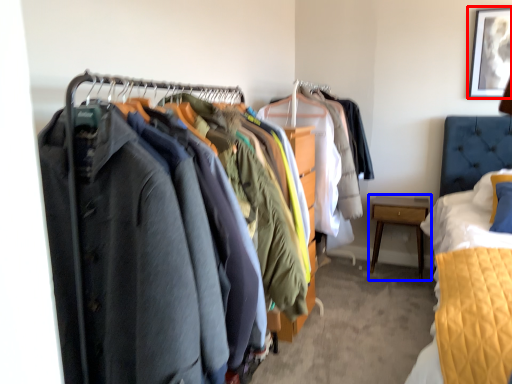
Question: Which object is closer to the camera taking this photo, picture frame (highlighted by a red box) or nightstand (highlighted by a blue box)?

Choices:
 (A) picture frame
 (B) nightstand

Answer: (A)